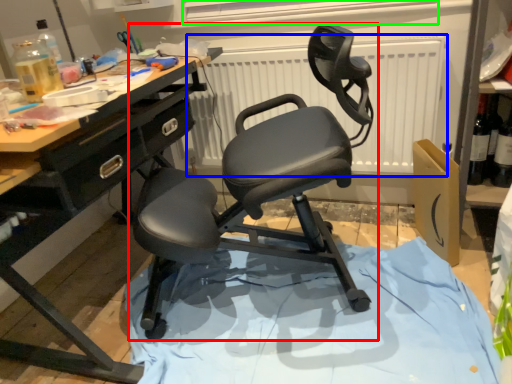
Question: Which object is the closest to the chair (highlighted by a red box)? Choose among these: radiator (highlighted by a blue box) or window screen (highlighted by a green box).

Choices:
 (A) radiator
 (B) window screen

Answer: (A)